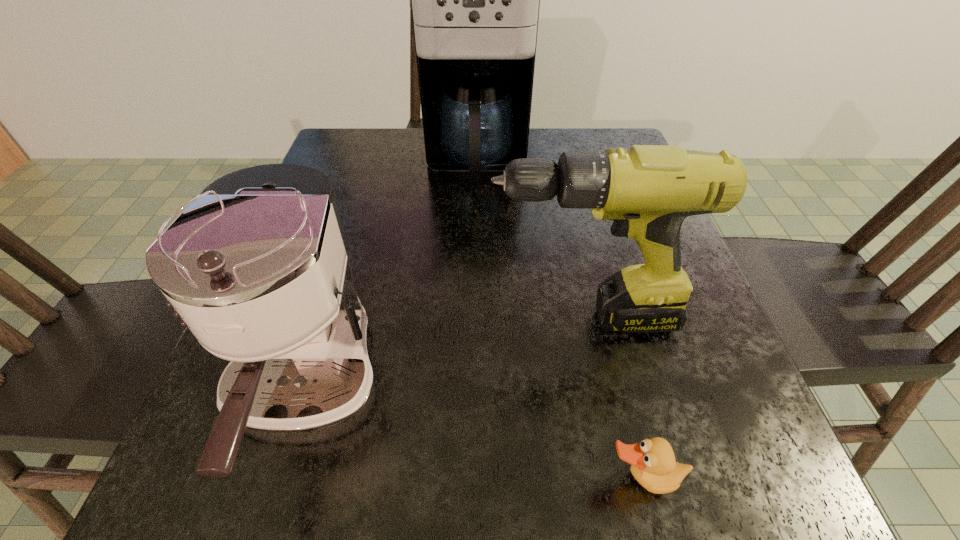
At what (x,y) coordinates should I click in order to perform the action: click on the farther coffee maker. Please return your answer as a coordinate pair (x, y). Looking at the image, I should click on (475, 0).

I want to click on the farthest object, so click(475, 0).

The height and width of the screenshot is (540, 960). In order to click on drill in this screenshot , I will do `click(647, 191)`.

Locate an element on the screen. the nearer coffee maker is located at coordinates (257, 267).

I want to click on the left coffee maker, so (x=257, y=267).

Where is `the shortest object`? the shortest object is located at coordinates (653, 465).

This screenshot has height=540, width=960. What are the coordinates of `free location located 0.360m on the front panel of the farthest object` in the screenshot? It's located at (475, 338).

Find the location of `vacant space located on the handle side of the drill`. vacant space located on the handle side of the drill is located at coordinates (340, 318).

The width and height of the screenshot is (960, 540). I want to click on vacant area situated on the handle side of the drill, so click(x=260, y=318).

This screenshot has height=540, width=960. Identify the location of free point located 0.240m on the handle side of the drill. (340, 318).